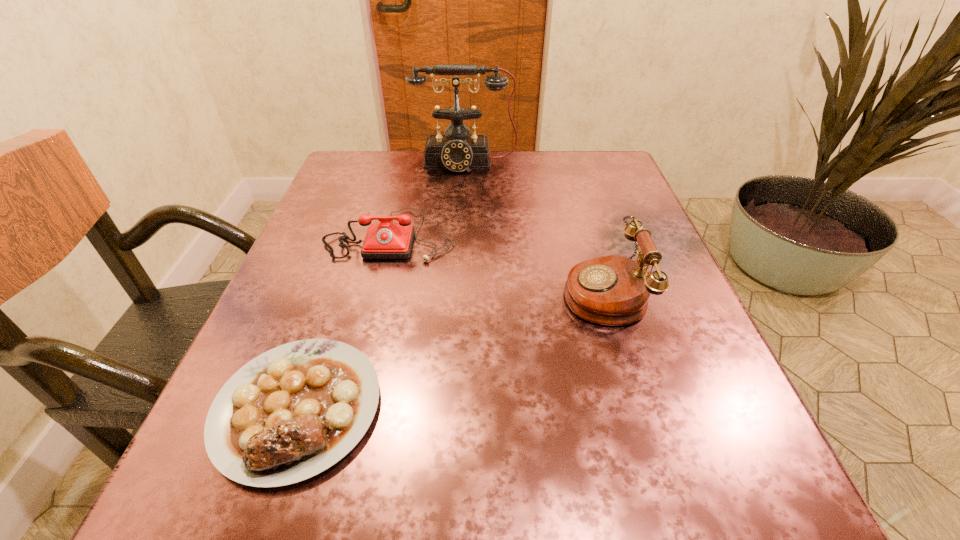
Locate an element on the screen. The width and height of the screenshot is (960, 540). unoccupied position between the nearest object and the third tallest object is located at coordinates (344, 321).

Where is `vacant area between the nearest object and the farthest object`? The height and width of the screenshot is (540, 960). vacant area between the nearest object and the farthest object is located at coordinates (381, 285).

I want to click on unoccupied position between the farthest telephone and the nearest object, so click(381, 285).

In order to click on free space between the shortest telephone and the nearest object in this screenshot , I will do `click(344, 321)`.

Locate an element on the screen. Image resolution: width=960 pixels, height=540 pixels. the third closest object relative to the shortest telephone is located at coordinates (614, 290).

Image resolution: width=960 pixels, height=540 pixels. Find the location of `object that is the closest to the rightmost telephone`. object that is the closest to the rightmost telephone is located at coordinates 386,240.

Locate which telephone ranks in proximity to the steak. Please provide its 2D coordinates. Your answer should be formatted as a tuple, i.e. [(x, y)], where the tuple contains the x and y coordinates of a point satisfying the conditions above.

[(386, 240)]

Select which telephone is the second closest to the farthest object. Please provide its 2D coordinates. Your answer should be formatted as a tuple, i.e. [(x, y)], where the tuple contains the x and y coordinates of a point satisfying the conditions above.

[(614, 290)]